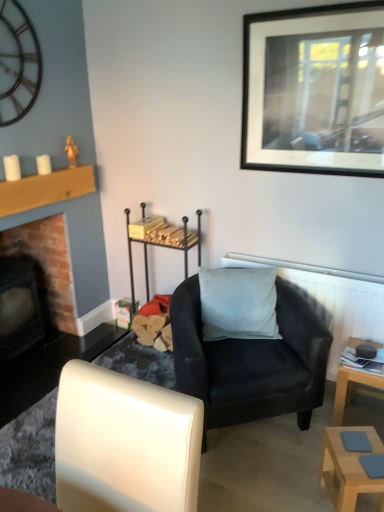
Measure the distance between white textured radiator at upper right and camera.

They are 2.16 meters apart.

Describe the element at coordinates (46, 267) in the screenshot. Image resolution: width=384 pixels, height=512 pixels. I see `brick fireplace at left` at that location.

Describe the element at coordinates (315, 90) in the screenshot. I see `black matte picture frame at upper right` at that location.

Where is `white leather chair at lower left, the first chair viewed from the front`? The image size is (384, 512). white leather chair at lower left, the first chair viewed from the front is located at coordinates (124, 443).

The width and height of the screenshot is (384, 512). In order to click on white textured radiator at upper right in this screenshot , I will do point(332,298).

In the image, is light brown wooden table at lower right, which is the 2th table from front to back, on the left side or the right side of suede-like gray pillow at center?

light brown wooden table at lower right, which is the 2th table from front to back, is positioned on suede-like gray pillow at center's right side.

Between light brown wooden table at lower right, which is the 2th table from front to back, and suede-like gray pillow at center, which one has less height?

light brown wooden table at lower right, which is the 2th table from front to back, is shorter.

Is light brown wooden table at lower right, which is the first table from back to front, positioned behind suede-like gray pillow at center?

No, it is in front of suede-like gray pillow at center.

Is light brown wooden table at lower right, which is the 2th table from front to back, oriented away from suede-like gray pillow at center?

light brown wooden table at lower right, which is the 2th table from front to back, is not turned away from suede-like gray pillow at center.

Can metallic clock at upper left be found inside black matte picture frame at upper right?

No, metallic clock at upper left is located outside of black matte picture frame at upper right.

Looking at their sizes, would you say black matte picture frame at upper right is wider or thinner than metallic clock at upper left?

In the image, black matte picture frame at upper right appears to be wider than metallic clock at upper left.

Is black matte picture frame at upper right bigger or smaller than metallic clock at upper left?

black matte picture frame at upper right is bigger than metallic clock at upper left.

Consider the image. From the image's perspective, between white leather chair at lower left, the first chair viewed from the front, and white textured radiator at upper right, who is located below?

white leather chair at lower left, the first chair viewed from the front, from the image's perspective.

Find the location of a particular element. radiator behind the white leather chair at lower left, the first chair viewed from the front is located at coordinates (332, 298).

Does white leather chair at lower left, the 2th chair when ordered from back to front, have a lesser height compared to white textured radiator at upper right?

No.

Considering the sizes of white leather chair at lower left, the first chair viewed from the front, and white textured radiator at upper right in the image, is white leather chair at lower left, the first chair viewed from the front, wider or thinner than white textured radiator at upper right?

Clearly, white leather chair at lower left, the first chair viewed from the front, has more width compared to white textured radiator at upper right.

Considering the positions of points (321, 403) and (34, 268), is point (321, 403) closer to camera compared to point (34, 268)?

Yes, point (321, 403) is in front of point (34, 268).

I want to click on the 2nd chair counting from the right side of the brick fireplace at left, so click(251, 362).

Is matte black armchair at center, the first chair positioned from the back, inside or outside of brick fireplace at left?

matte black armchair at center, the first chair positioned from the back, is spatially situated outside brick fireplace at left.

Between matte black armchair at center, the first chair positioned from the back, and brick fireplace at left, which one has larger width?

With larger width is matte black armchair at center, the first chair positioned from the back.

Can you see white textured radiator at upper right touching light brown wooden table at lower right, which is the first table from back to front?

No, white textured radiator at upper right is not with light brown wooden table at lower right, which is the first table from back to front.

Considering their positions, is white textured radiator at upper right located in front of or behind light brown wooden table at lower right, which is the first table from back to front?

Visually, white textured radiator at upper right is located behind light brown wooden table at lower right, which is the first table from back to front.

Which is more to the right, white textured radiator at upper right or light brown wooden table at lower right, which is the 2th table from front to back?

From the viewer's perspective, light brown wooden table at lower right, which is the 2th table from front to back, appears more on the right side.

How distant is white textured radiator at upper right from light brown wooden table at lower right, which is the first table from back to front?

The distance of white textured radiator at upper right from light brown wooden table at lower right, which is the first table from back to front, is 23.62 centimeters.

Could you tell me if light wood table at lower right, the 2th table when ordered from back to front, is facing brick fireplace at left?

No, light wood table at lower right, the 2th table when ordered from back to front, is not facing towards brick fireplace at left.

Is light wood table at lower right, the 2th table when ordered from back to front, to the left of brick fireplace at left from the viewer's perspective?

In fact, light wood table at lower right, the 2th table when ordered from back to front, is to the right of brick fireplace at left.

Which of these two, light wood table at lower right, the 2th table when ordered from back to front, or brick fireplace at left, is smaller?

light wood table at lower right, the 2th table when ordered from back to front, is smaller.

The height and width of the screenshot is (512, 384). Find the location of `table that is the 2nd one when counting downward from the brick fireplace at left (from the image's perspective)`. table that is the 2nd one when counting downward from the brick fireplace at left (from the image's perspective) is located at coordinates (348, 469).

Is matte black armchair at center, the 2th chair positioned from the front, positioned before light wood table at lower right, the 2th table when ordered from back to front?

No, matte black armchair at center, the 2th chair positioned from the front, is further to the viewer.

Based on the photo, between matte black armchair at center, the first chair positioned from the back, and light wood table at lower right, the 2th table when ordered from back to front, which one has larger size?

With larger size is matte black armchair at center, the first chair positioned from the back.

Is matte black armchair at center, the 2th chair positioned from the front, outside of light wood table at lower right, positioned as the first table in front-to-back order?

Yes.

Between point (202, 389) and point (338, 447), which one is positioned in front?

Positioned in front is point (338, 447).

From the image's perspective, which table is the 1st one below the suede-like gray pillow at center? Please provide its 2D coordinates.

[(351, 388)]

Where is `clock behind the black matte picture frame at upper right`? The image size is (384, 512). clock behind the black matte picture frame at upper right is located at coordinates (17, 63).

When comparing their distances from brick fireplace at left, does black matte picture frame at upper right or white leather chair at lower left, the 2th chair when ordered from back to front, seem closer?

black matte picture frame at upper right.

When comparing their distances from brick fireplace at left, does white leather chair at lower left, the 2th chair when ordered from back to front, or white textured radiator at upper right seem further?

white leather chair at lower left, the 2th chair when ordered from back to front, lies further to brick fireplace at left than the other object.

Looking at the image, which one is located further to metallic clock at upper left, white leather chair at lower left, the 2th chair when ordered from back to front, or black matte picture frame at upper right?

Among the two, white leather chair at lower left, the 2th chair when ordered from back to front, is located further to metallic clock at upper left.

Based on their spatial positions, is black matte picture frame at upper right or suede-like gray pillow at center closer to white textured radiator at upper right?

Based on the image, suede-like gray pillow at center appears to be nearer to white textured radiator at upper right.

From the image, which object appears to be nearer to metallic clock at upper left, suede-like gray pillow at center or matte black armchair at center, the first chair positioned from the back?

suede-like gray pillow at center.

From the image, which object appears to be nearer to matte black armchair at center, the first chair positioned from the back, metallic clock at upper left or white leather chair at lower left, the 2th chair when ordered from back to front?

The object closer to matte black armchair at center, the first chair positioned from the back, is white leather chair at lower left, the 2th chair when ordered from back to front.

When comparing their distances from metallic clock at upper left, does brick fireplace at left or white leather chair at lower left, the 2th chair when ordered from back to front, seem further?

white leather chair at lower left, the 2th chair when ordered from back to front.

Looking at the image, which one is located further to brick fireplace at left, metallic clock at upper left or matte black armchair at center, the first chair positioned from the back?

matte black armchair at center, the first chair positioned from the back, is positioned further to the anchor brick fireplace at left.

Identify the location of pillow between metallic clock at upper left and black matte picture frame at upper right from left to right. This screenshot has height=512, width=384. (238, 303).

This screenshot has width=384, height=512. What are the coordinates of `picture frame positioned between white leather chair at lower left, the first chair viewed from the front, and suede-like gray pillow at center from near to far` in the screenshot? It's located at (315, 90).

The height and width of the screenshot is (512, 384). I want to click on pillow between metallic clock at upper left and matte black armchair at center, the first chair positioned from the back, in the vertical direction, so click(238, 303).

At what (x,y) coordinates should I click in order to perform the action: click on table between suede-like gray pillow at center and light wood table at lower right, positioned as the first table in front-to-back order, from top to bottom. Please return your answer as a coordinate pair (x, y). The width and height of the screenshot is (384, 512). Looking at the image, I should click on [x=351, y=388].